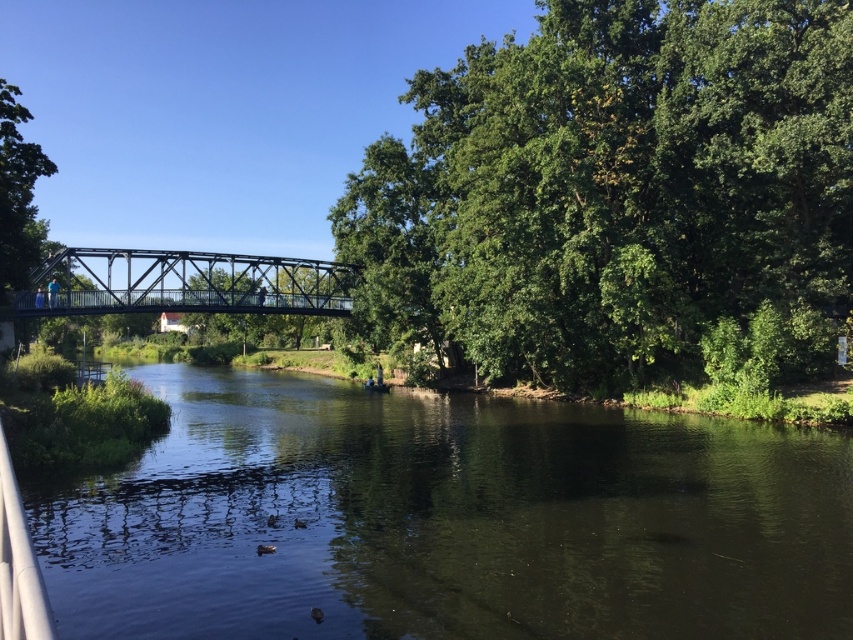
Question: Which object is closer to the camera taking this photo?

Choices:
 (A) dark green water at center
 (B) green leafy tree at center
 (C) metallic bridge at center

Answer: (A)

Question: From the image, what is the correct spatial relationship of dark green water at center in relation to metallic bridge at center?

Choices:
 (A) above
 (B) below

Answer: (B)

Question: Does dark green water at center appear over metallic bridge at center?

Choices:
 (A) no
 (B) yes

Answer: (A)

Question: Is dark green water at center thinner than green leafy tree at center?

Choices:
 (A) yes
 (B) no

Answer: (B)

Question: Which object is positioned farthest from the metallic bridge at center?

Choices:
 (A) green leafy tree at center
 (B) dark green water at center

Answer: (B)

Question: Among these objects, which one is nearest to the camera?

Choices:
 (A) metallic bridge at center
 (B) dark green water at center
 (C) green leafy tree at center

Answer: (B)